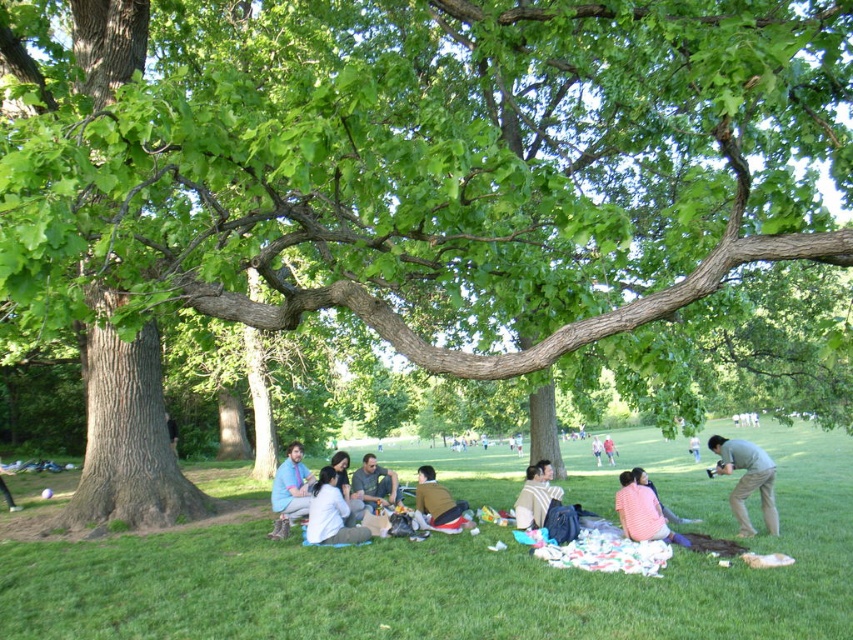
Question: Does light blue shirt at center appear on the right side of light brown cotton shirt at center?

Choices:
 (A) no
 (B) yes

Answer: (A)

Question: Which point appears farthest from the camera in this image?

Choices:
 (A) (631, 492)
 (B) (757, 461)

Answer: (B)

Question: Estimate the real-world distances between objects in this image. Which object is farther from the white fabric at center?

Choices:
 (A) gray fabric shirt at center
 (B) pink cotton sweater at lower center
 (C) pink fabric at lower right
 (D) light blue fabric shirt at lower left

Answer: (C)

Question: Is green grass at lower center positioned in front of light blue shirt at center?

Choices:
 (A) no
 (B) yes

Answer: (B)

Question: Does green grass at lower center have a smaller size compared to white fabric at center?

Choices:
 (A) yes
 (B) no

Answer: (B)

Question: Estimate the real-world distances between objects in this image. Which object is farther from the pink cotton sweater at lower center?

Choices:
 (A) pink fabric at lower right
 (B) knit sweater at lower right
 (C) light green shirt at lower right

Answer: (C)